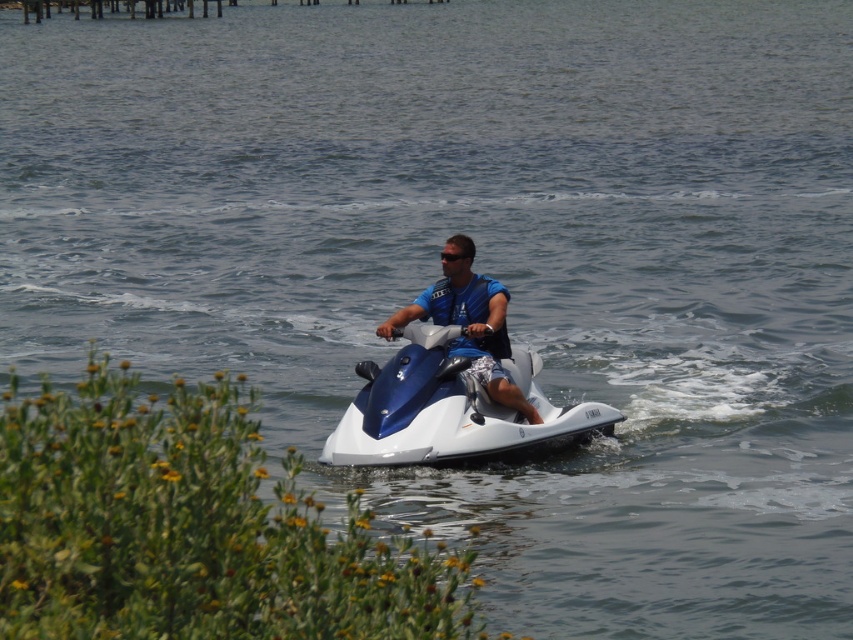
You are navigating a jet ski and need to reach a destination point. You observe two points in the water marked as point (503, 397) and point (457, 259). Which point is closer to your current position if you are facing the direction of the pier in the background?

Point (503, 397) is in front of point (457, 259), so if you are facing the direction of the pier in the background, point (503, 397) would be closer to your current position.

You are a photographer trying to capture the blue glossy snowmobile at center and the blue matte life vest at center in the same frame. Which object should you position closer to the left side of your camera viewfinder to ensure both are visible?

You should position the blue glossy snowmobile at center closer to the left side of your camera viewfinder because it is already to the left of the blue matte life vest at center.

You are a safety inspector checking the safety gear of the jet ski rider. The rider has a blue matte life vest at center and black plastic goggles at center. According to safety regulations, the distance between the life vest and goggles must be less than 50 centimeters to ensure quick access. Is the current arrangement compliant?

The blue matte life vest at center is 76.21 centimeters from the black plastic goggles at center, which exceeds the 50 centimeter requirement. Therefore, the current arrangement is not compliant with safety regulations.